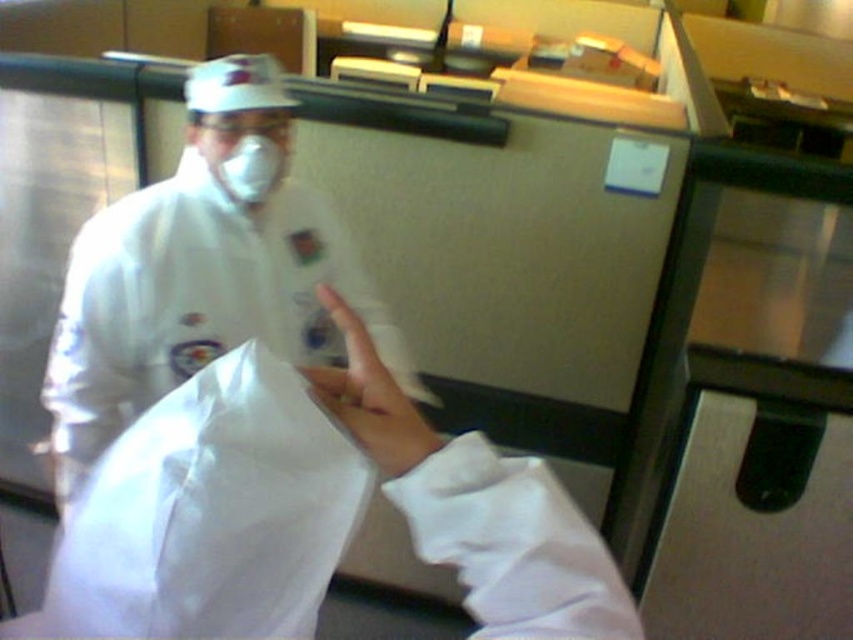
Is white matte lab coat at center positioned behind matte white mask at center?

No, white matte lab coat at center is closer to the viewer.

Is point (196, 301) closer to camera compared to point (257, 204)?

Yes, it is in front of point (257, 204).

The height and width of the screenshot is (640, 853). Find the location of `white matte lab coat at center`. white matte lab coat at center is located at coordinates (201, 269).

Is white matte lab coat at center closer to the viewer compared to white matte hand at center?

No, white matte lab coat at center is further to the viewer.

Is point (331, 332) more distant than point (396, 412)?

Yes, point (331, 332) is behind point (396, 412).

I want to click on white matte lab coat at center, so click(x=201, y=269).

Who is more distant from viewer, (x=340, y=396) or (x=225, y=150)?

Point (x=225, y=150)

Which of these two, white matte hand at center or matte white mask at center, stands taller?

white matte hand at center is taller.

The height and width of the screenshot is (640, 853). Describe the element at coordinates (369, 397) in the screenshot. I see `white matte hand at center` at that location.

The height and width of the screenshot is (640, 853). I want to click on white matte hand at center, so click(x=369, y=397).